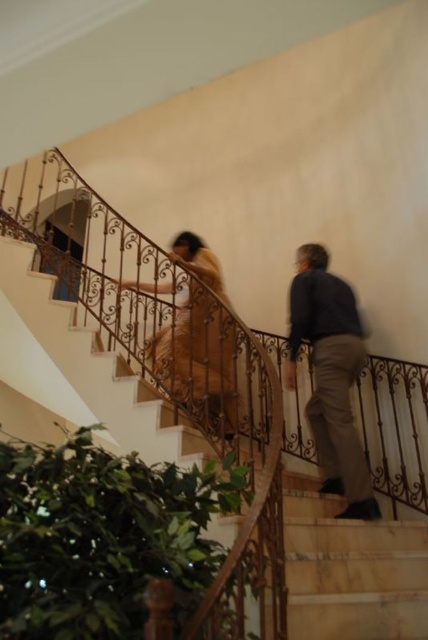
You are a fashion designer observing two dresses displayed on mannequins in a store window. The dresses are the tan fabric dress at center and the brown textured dress at center. Which dress is smaller in size?

The tan fabric dress at center has a smaller size compared to the brown textured dress at center.

You are standing at the bottom of the staircase and want to reach the top. Which object, the marble stairs at center or the brown textured dress at center, should you step onto first?

You should step onto the marble stairs at center first because it is in front of the brown textured dress at center, making it the correct path to ascend.